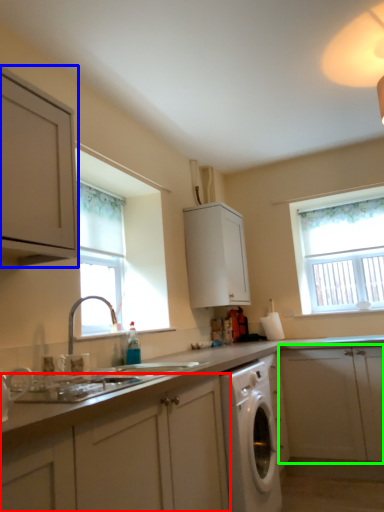
Question: Which is nearer to the cabinetry (highlighted by a red box)? cabinetry (highlighted by a blue box) or cabinetry (highlighted by a green box).

Choices:
 (A) cabinetry
 (B) cabinetry

Answer: (A)